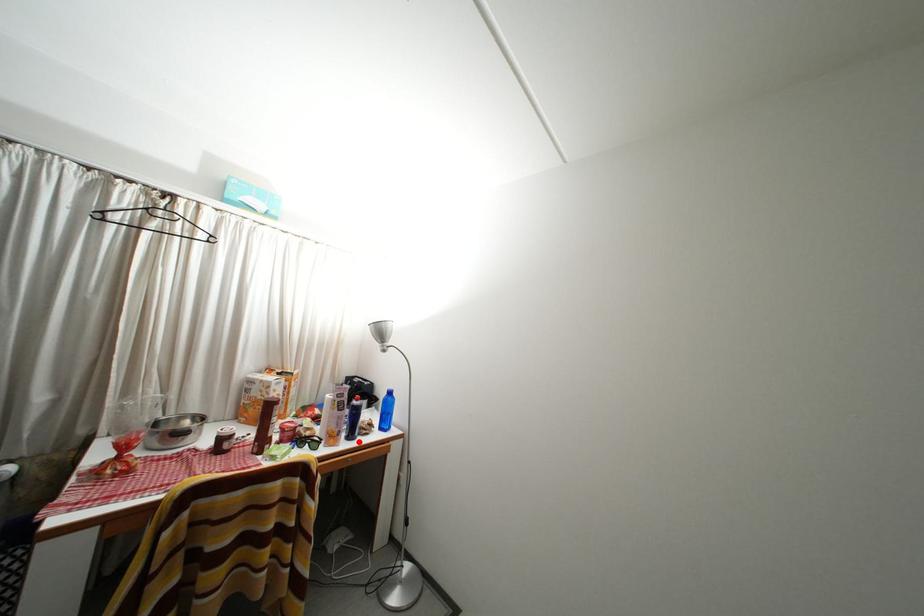
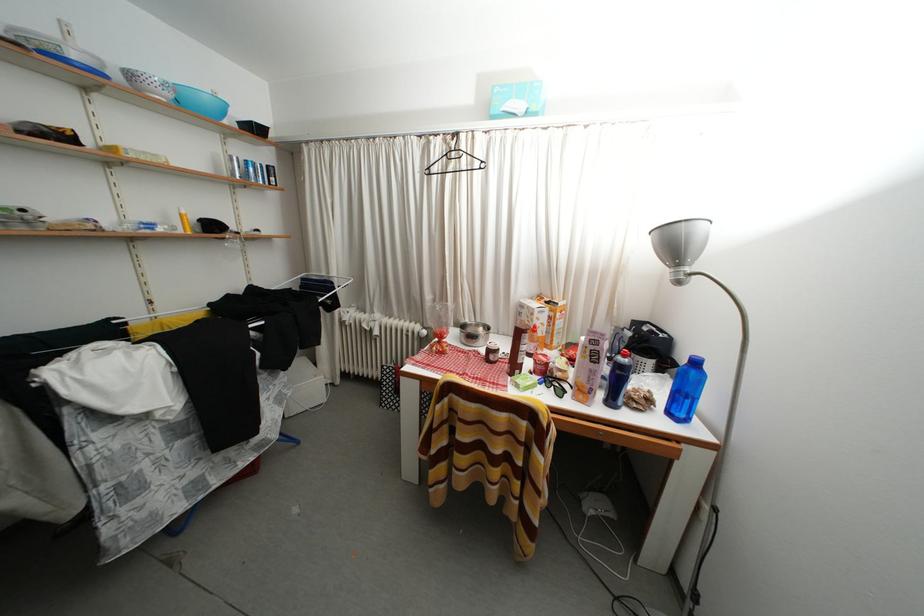
Find the pixel in the second image that matches the highlighted location in the first image.

(618, 408)